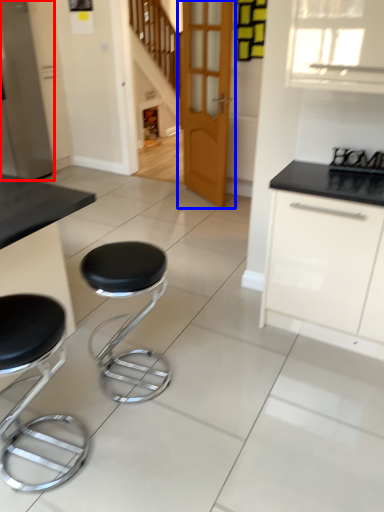
Question: Which point is further to the camera, appliance (highlighted by a red box) or door (highlighted by a blue box)?

Choices:
 (A) appliance
 (B) door

Answer: (A)